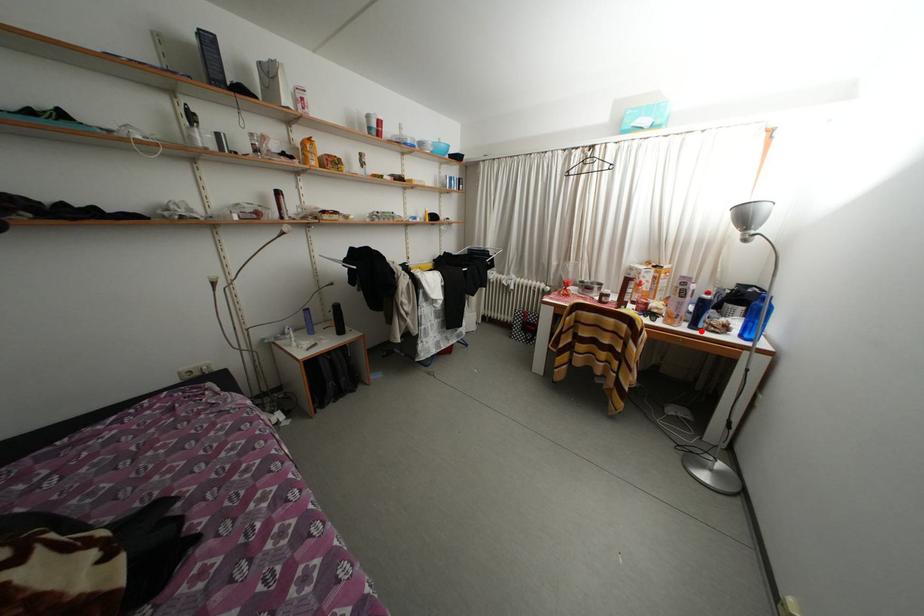
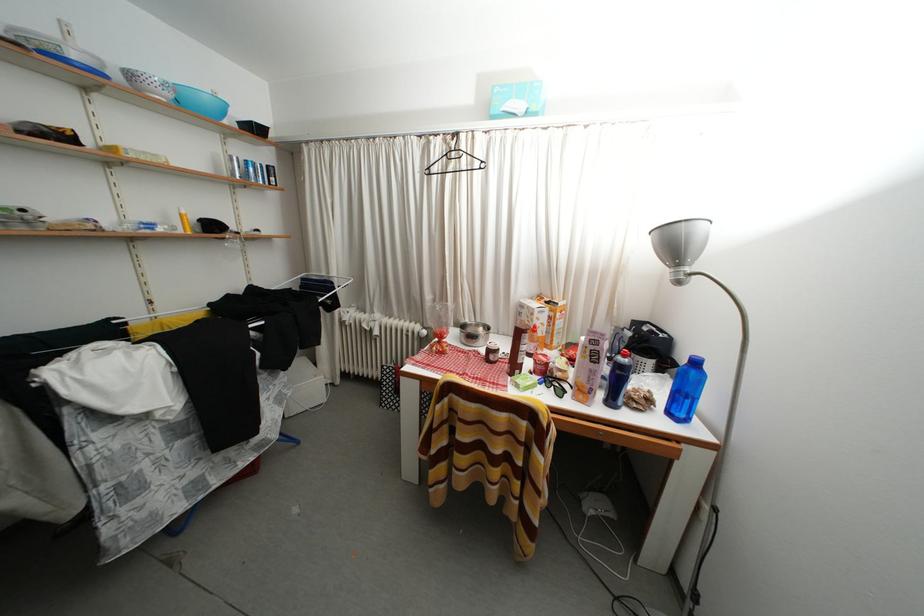
In the second image, find the point that corresponds to the highlighted location in the first image.

(618, 408)